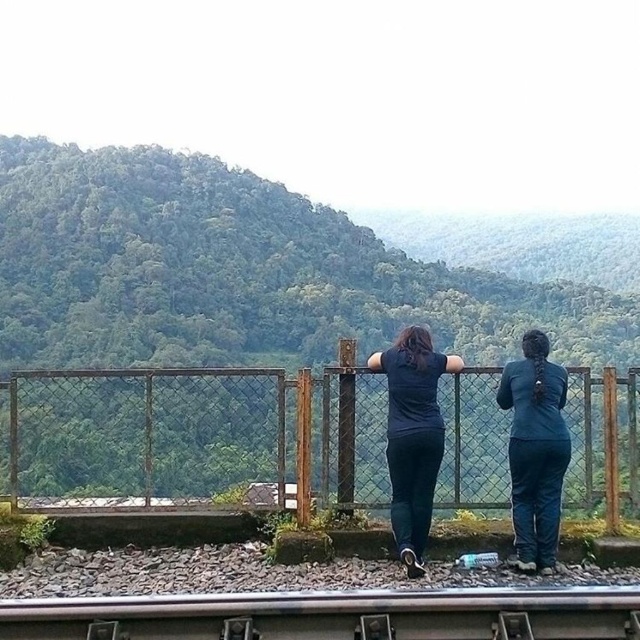
You are a photographer trying to capture the entire view of the green leafy forest at upper center and the teal fabric pants at right in a single frame. Considering their sizes, which object will occupy more space in your photo?

The green leafy forest at upper center will occupy more space in the photo since it has a larger size compared to the teal fabric pants at right.

You are a photographer standing on the railway platform. You want to take a photo of the green leafy forest at upper center and the teal fabric pants at right. Based on their positions, which object should you frame first in your camera viewfinder to ensure both are included in the shot?

The green leafy forest at upper center is positioned on the left side of the teal fabric pants at right. Therefore, you should frame the green leafy forest at upper center first, then adjust to include the teal fabric pants at right in the shot.